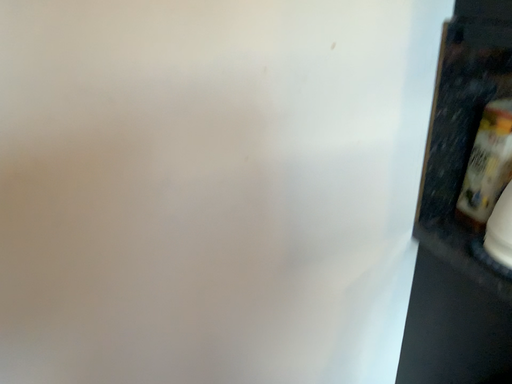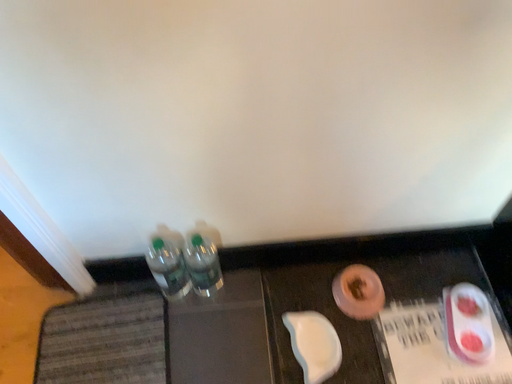
Question: How did the camera likely rotate when shooting the video?

Choices:
 (A) rotated upward
 (B) rotated downward

Answer: (B)